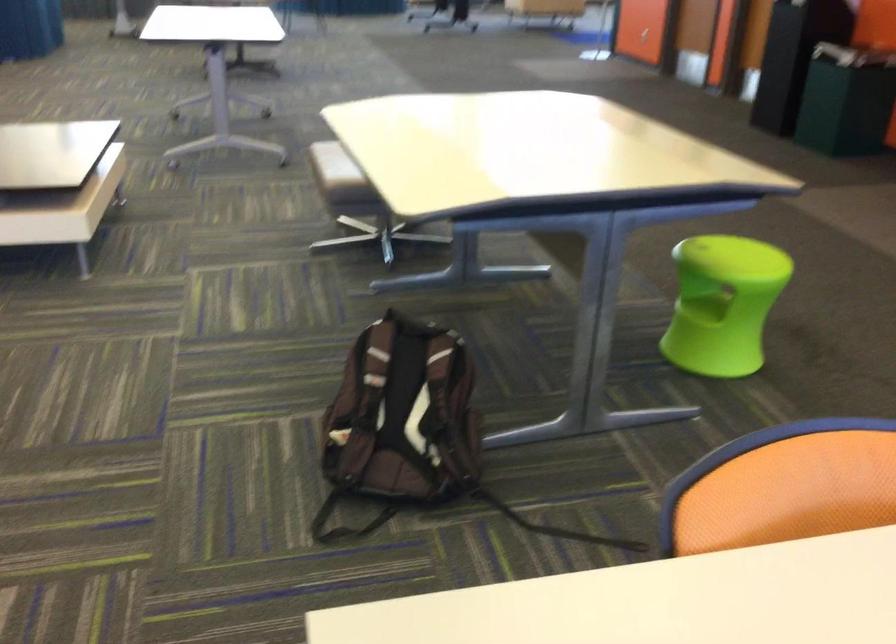
Find where to lift the green stool handle. Please return your answer as a coordinate pair (x, y).

(702, 307)